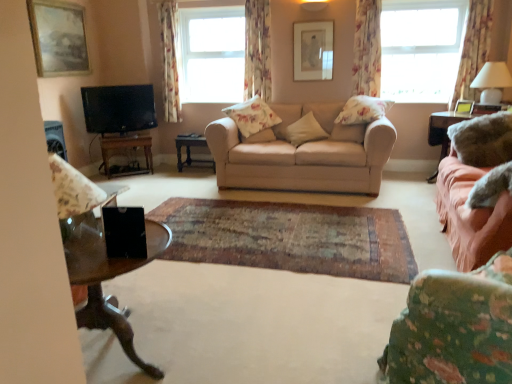
Describe the element at coordinates (258, 137) in the screenshot. I see `fluffy beige pillow at center, marked as the second pillow in a left-to-right arrangement` at that location.

The width and height of the screenshot is (512, 384). I want to click on rug at center, so click(289, 237).

You are a GUI agent. You are given a task and a screenshot of the screen. Output one action in this format:
    pyautogui.click(x=<x>, y=<y>)
    Task: Click on the beige fabric couch at center, which is the second studio couch from front to back
    
    Given the screenshot: What is the action you would take?
    pyautogui.click(x=304, y=154)

Identify the location of fluffy beige pillow at center, marked as the second pillow in a left-to-right arrangement. (258, 137).

Is transparent glass window at upper right, which is the 1th window in right-to-left order, facing away from beige fabric pillow at center, which is the 2th pillow in right-to-left order?

transparent glass window at upper right, which is the 1th window in right-to-left order, is not turned away from beige fabric pillow at center, which is the 2th pillow in right-to-left order.

Considering the sizes of objects transparent glass window at upper right, placed as the 1th window when sorted from front to back, and beige fabric pillow at center, the 3th pillow when ordered from left to right, in the image provided, who is bigger, transparent glass window at upper right, placed as the 1th window when sorted from front to back, or beige fabric pillow at center, the 3th pillow when ordered from left to right,?

transparent glass window at upper right, placed as the 1th window when sorted from front to back, is bigger.

Is point (453, 13) positioned in front of point (287, 132)?

No, (453, 13) is further to viewer.

Considering the relative positions of transparent glass window at upper right, which is the 1th window in right-to-left order, and beige fabric pillow at center, which is the 2th pillow in right-to-left order, in the image provided, is transparent glass window at upper right, which is the 1th window in right-to-left order, to the right of beige fabric pillow at center, which is the 2th pillow in right-to-left order, from the viewer's perspective?

Indeed, transparent glass window at upper right, which is the 1th window in right-to-left order, is positioned on the right side of beige fabric pillow at center, which is the 2th pillow in right-to-left order.

In the scene shown: From a real-world perspective, is wooden table at left, the third table when ordered from right to left, positioned over matte floral fabric armchair at left based on gravity?

No, from a real-world perspective, wooden table at left, the third table when ordered from right to left, is not above matte floral fabric armchair at left.

Which object is further away from the camera, wooden table at left, the third table when ordered from right to left, or matte floral fabric armchair at left?

wooden table at left, the third table when ordered from right to left, is behind.

In the scene shown: How different are the orientations of wooden table at left, the 1th table from the left, and matte floral fabric armchair at left in degrees?

They differ by 144 degrees in their facing directions.

Considering the relative positions of wooden table at left, the third table when ordered from right to left, and matte floral fabric armchair at left in the image provided, is wooden table at left, the third table when ordered from right to left, to the right of matte floral fabric armchair at left from the viewer's perspective?

No, wooden table at left, the third table when ordered from right to left, is not to the right of matte floral fabric armchair at left.

In the scene shown: From the image's perspective, which object appears higher, velvet pink couch at right, the second studio couch positioned from the back, or white fabric lampshade at upper right?

white fabric lampshade at upper right, from the image's perspective.

Is velvet pink couch at right, the second studio couch positioned from the back, thinner than white fabric lampshade at upper right?

No, velvet pink couch at right, the second studio couch positioned from the back, is not thinner than white fabric lampshade at upper right.

Which is correct: velvet pink couch at right, the second studio couch positioned from the back, is inside white fabric lampshade at upper right, or outside of it?

velvet pink couch at right, the second studio couch positioned from the back, is located beyond the bounds of white fabric lampshade at upper right.

The height and width of the screenshot is (384, 512). In order to click on lamp on the right of velvet pink couch at right, the first studio couch in the front-to-back sequence in this screenshot , I will do `click(492, 82)`.

From a real-world perspective, between satin pink fabric at right, acting as the third table starting from the left, and fluffy white pillow at center, which ranks as the 4th pillow in left-to-right order, who is vertically lower?

satin pink fabric at right, acting as the third table starting from the left, is physically lower.

Who is bigger, satin pink fabric at right, acting as the third table starting from the left, or fluffy white pillow at center, which appears as the 1th pillow when viewed from the right?

With larger size is satin pink fabric at right, acting as the third table starting from the left.

Which is correct: satin pink fabric at right, marked as the first table in a right-to-left arrangement, is inside fluffy white pillow at center, which appears as the 1th pillow when viewed from the right, or outside of it?

satin pink fabric at right, marked as the first table in a right-to-left arrangement, is located beyond the bounds of fluffy white pillow at center, which appears as the 1th pillow when viewed from the right.

Measure the distance between satin pink fabric at right, marked as the first table in a right-to-left arrangement, and fluffy white pillow at center, which ranks as the 4th pillow in left-to-right order.

satin pink fabric at right, marked as the first table in a right-to-left arrangement, and fluffy white pillow at center, which ranks as the 4th pillow in left-to-right order, are 73.28 centimeters apart.

Which object is thinner, beige fabric pillow at center, which is the 2th pillow in right-to-left order, or white fabric lampshade at upper right?

white fabric lampshade at upper right.

Is beige fabric pillow at center, the 3th pillow when ordered from left to right, in front of or behind white fabric lampshade at upper right in the image?

beige fabric pillow at center, the 3th pillow when ordered from left to right, is behind white fabric lampshade at upper right.

Is beige fabric pillow at center, which is the 2th pillow in right-to-left order, positioned far away from white fabric lampshade at upper right?

beige fabric pillow at center, which is the 2th pillow in right-to-left order, is far away from white fabric lampshade at upper right.

From the image's perspective, is beige fabric pillow at center, the 3th pillow when ordered from left to right, located beneath white fabric lampshade at upper right?

Yes.

Which is more to the left, floral fabric curtain at upper right, which appears as the 1th curtain when viewed from the right, or floral fabric curtain at left, which is the fourth curtain in right-to-left order?

From the viewer's perspective, floral fabric curtain at left, which is the fourth curtain in right-to-left order, appears more on the left side.

Is floral fabric curtain at upper right, which appears as the 1th curtain when viewed from the right, facing away from floral fabric curtain at left, the 1th curtain in the left-to-right sequence?

floral fabric curtain at upper right, which appears as the 1th curtain when viewed from the right, is not turned away from floral fabric curtain at left, the 1th curtain in the left-to-right sequence.

From the picture: Is floral fabric curtain at left, the 1th curtain in the left-to-right sequence, inside floral fabric curtain at upper right, which appears as the 1th curtain when viewed from the right?

Actually, floral fabric curtain at left, the 1th curtain in the left-to-right sequence, is outside floral fabric curtain at upper right, which appears as the 1th curtain when viewed from the right.

Can you tell me how much floral fabric curtain at upper right, marked as the 4th curtain in a left-to-right arrangement, and floral fabric curtain at left, the 1th curtain in the left-to-right sequence, differ in facing direction?

0.0013 degrees separate the facing orientations of floral fabric curtain at upper right, marked as the 4th curtain in a left-to-right arrangement, and floral fabric curtain at left, the 1th curtain in the left-to-right sequence.

The width and height of the screenshot is (512, 384). In order to click on television above the fluffy beige pillow at center, marked as the second pillow in a left-to-right arrangement (from the image's perspective) in this screenshot , I will do `click(118, 108)`.

Does matte black tv at left turn towards fluffy beige pillow at center, the 3th pillow when ordered from right to left?

No, matte black tv at left does not turn towards fluffy beige pillow at center, the 3th pillow when ordered from right to left.

Which of these two, matte black tv at left or fluffy beige pillow at center, marked as the second pillow in a left-to-right arrangement, stands shorter?

Standing shorter between the two is fluffy beige pillow at center, marked as the second pillow in a left-to-right arrangement.

From the image's perspective, count 1st windows upward from the beige fabric pillow at center, which is the 2th pillow in right-to-left order, and point to it. Please provide its 2D coordinates.

[(421, 49)]

Identify the location of armchair located above the wooden table at left, the third table when ordered from right to left (from a real-world perspective). Image resolution: width=512 pixels, height=384 pixels. (73, 188).

Consider the image. From the image, which object appears to be nearer to beige fabric pillow at center, the 3th pillow when ordered from left to right, transparent glass coffee table at lower left or white fabric lampshade at upper right?

The object closer to beige fabric pillow at center, the 3th pillow when ordered from left to right, is white fabric lampshade at upper right.

When comparing their distances from clear glass window at upper center, which ranks as the 1th window in left-to-right order, does velvet pink couch at right, acting as the 2th studio couch starting from the left, or white fabric lampshade at upper right seem closer?

white fabric lampshade at upper right is closer to clear glass window at upper center, which ranks as the 1th window in left-to-right order.

Estimate the real-world distances between objects in this image. Which object is closer to floral fabric pillow at center, the fourth pillow from the right, beige fabric couch at center, the 1th studio couch viewed from the back, or transparent glass window at upper right, the second window viewed from the left?

Based on the image, beige fabric couch at center, the 1th studio couch viewed from the back, appears to be nearer to floral fabric pillow at center, the fourth pillow from the right.

Looking at this image, from the image, which object appears to be nearer to floral fabric curtain at upper center, placed as the 2th curtain when sorted from left to right, rug at center or clear glass window at upper center, the first window when ordered from back to front?

The object closer to floral fabric curtain at upper center, placed as the 2th curtain when sorted from left to right, is clear glass window at upper center, the first window when ordered from back to front.

Considering their positions, is matte white picture frame at upper center, arranged as the 2th picture frame when viewed from the right, positioned closer to fluffy beige pillow at center, the 3th pillow when ordered from right to left, than satin pink fabric at right, marked as the first table in a right-to-left arrangement?

matte white picture frame at upper center, arranged as the 2th picture frame when viewed from the right.

Based on their spatial positions, is floral fabric curtain at upper center, the third curtain viewed from the right, or transparent glass window at upper right, placed as the 1th window when sorted from front to back, closer to fluffy white pillow at center, which ranks as the 4th pillow in left-to-right order?

floral fabric curtain at upper center, the third curtain viewed from the right, is positioned closer to the anchor fluffy white pillow at center, which ranks as the 4th pillow in left-to-right order.

Estimate the real-world distances between objects in this image. Which object is closer to floral fabric pillow at center, placed as the first pillow when sorted from left to right, floral fabric curtain at right, marked as the second curtain in a right-to-left arrangement, or velvet pink couch at right, the first studio couch in the front-to-back sequence?

floral fabric curtain at right, marked as the second curtain in a right-to-left arrangement, is positioned closer to the anchor floral fabric pillow at center, placed as the first pillow when sorted from left to right.

Which object lies further to the anchor point transparent glass window at upper right, placed as the 1th window when sorted from front to back, matte black tv at left or white fabric lampshade at upper right?

matte black tv at left is further to transparent glass window at upper right, placed as the 1th window when sorted from front to back.

Locate an element on the screen. The height and width of the screenshot is (384, 512). picture frame between matte black tv at left and transparent glass window at upper right, the second window viewed from the left, from left to right is located at coordinates (313, 51).

This screenshot has width=512, height=384. I want to click on pillow between matte white picture frame at upper center, arranged as the 2th picture frame when viewed from the right, and transparent glass window at upper right, which is the 1th window in right-to-left order, from left to right, so click(362, 110).

This screenshot has width=512, height=384. In order to click on plain between matte black tv at left and floral fabric curtain at upper right, which appears as the 1th curtain when viewed from the right, from left to right in this screenshot , I will do `click(289, 237)`.

Find the location of a particular element. plain located between matte floral fabric armchair at left and beige fabric pillow at center, which is the 2th pillow in right-to-left order, in the depth direction is located at coordinates (289, 237).